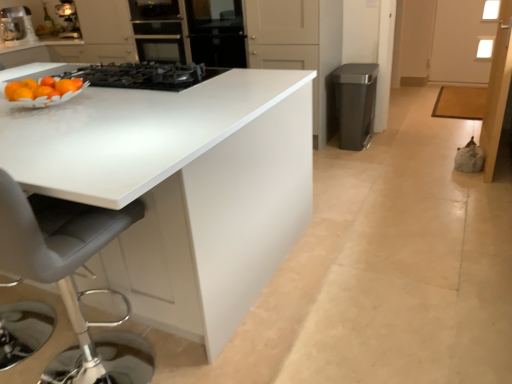
Question: Considering the relative sizes of black glass oven at center and satin metallic trash can at right in the image provided, is black glass oven at center taller than satin metallic trash can at right?

Choices:
 (A) no
 (B) yes

Answer: (A)

Question: Is black glass oven at center facing towards satin metallic trash can at right?

Choices:
 (A) no
 (B) yes

Answer: (A)

Question: Is satin metallic trash can at right at the back of black glass oven at center?

Choices:
 (A) no
 (B) yes

Answer: (A)

Question: Is black glass oven at center positioned before satin metallic trash can at right?

Choices:
 (A) no
 (B) yes

Answer: (A)

Question: From the image's perspective, is black glass oven at center located above satin metallic trash can at right?

Choices:
 (A) yes
 (B) no

Answer: (A)

Question: Looking at the image, does gray leather swivel chair at left seem bigger or smaller compared to black matte gas stove at upper center?

Choices:
 (A) small
 (B) big

Answer: (B)

Question: From the image's perspective, is gray leather swivel chair at left located above or below black matte gas stove at upper center?

Choices:
 (A) above
 (B) below

Answer: (B)

Question: Is point (92, 380) positioned closer to the camera than point (190, 81)?

Choices:
 (A) farther
 (B) closer

Answer: (B)

Question: Choose the correct answer: Is gray leather swivel chair at left inside black matte gas stove at upper center or outside it?

Choices:
 (A) inside
 (B) outside

Answer: (B)

Question: From a real-world perspective, is black glass oven at center positioned above or below gray leather swivel chair at left?

Choices:
 (A) below
 (B) above

Answer: (B)

Question: In terms of size, does black glass oven at center appear bigger or smaller than gray leather swivel chair at left?

Choices:
 (A) small
 (B) big

Answer: (A)

Question: Is black glass oven at center inside the boundaries of gray leather swivel chair at left, or outside?

Choices:
 (A) outside
 (B) inside

Answer: (A)

Question: Is black glass oven at center to the left or to the right of gray leather swivel chair at left in the image?

Choices:
 (A) left
 (B) right

Answer: (A)

Question: From the image's perspective, relative to white glossy table at center, is metallic silver coffee maker at upper left above or below?

Choices:
 (A) above
 (B) below

Answer: (A)

Question: Considering the positions of point (10, 11) and point (139, 264), is point (10, 11) closer or farther from the camera than point (139, 264)?

Choices:
 (A) closer
 (B) farther

Answer: (B)